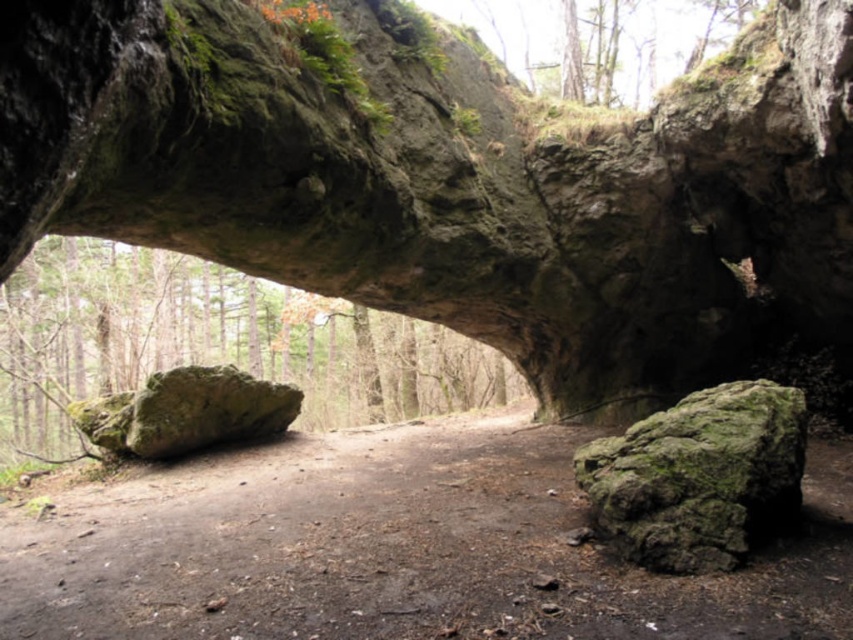
You are a hiker trying to cross the area under the rock archway. You need to step on the dull brown dirt at center and the green mossy rock at left. Which surface will you have more space to step on?

The green mossy rock at left is larger than the dull brown dirt at center, so you will have more space to step on the green mossy rock at left.